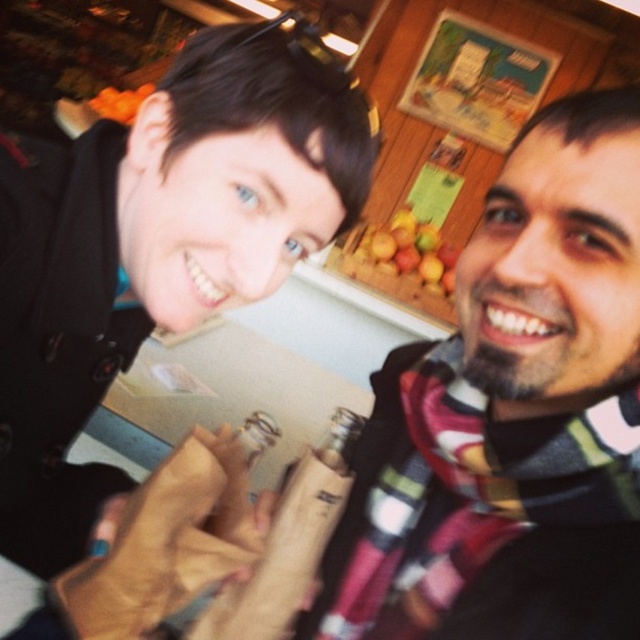
From the picture: You are standing at the point labeled point (176,262). You want to reach the door located at the other side of the room. The door is 28 inches wide. Can you pass through the door without touching the sides?

The distance between you and the door is 24.16 inches, which is less than the door width of 28 inches. Therefore, you can pass through the door without touching the sides.

You are a photographer setting up for a portrait. You need to ensure that the flannel scarf at right and the smooth wooden board at upper center are both visible in the frame. Given their sizes, which object might require you to adjust your camera angle to include it fully?

The flannel scarf at right is taller than the smooth wooden board at upper center, so you might need to adjust your camera angle to include the flannel scarf at right fully in the frame.